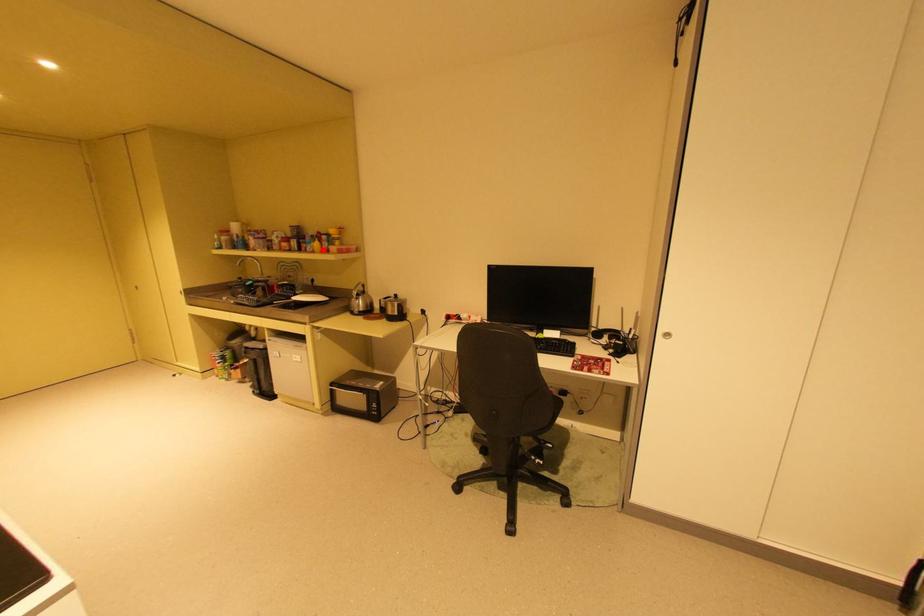
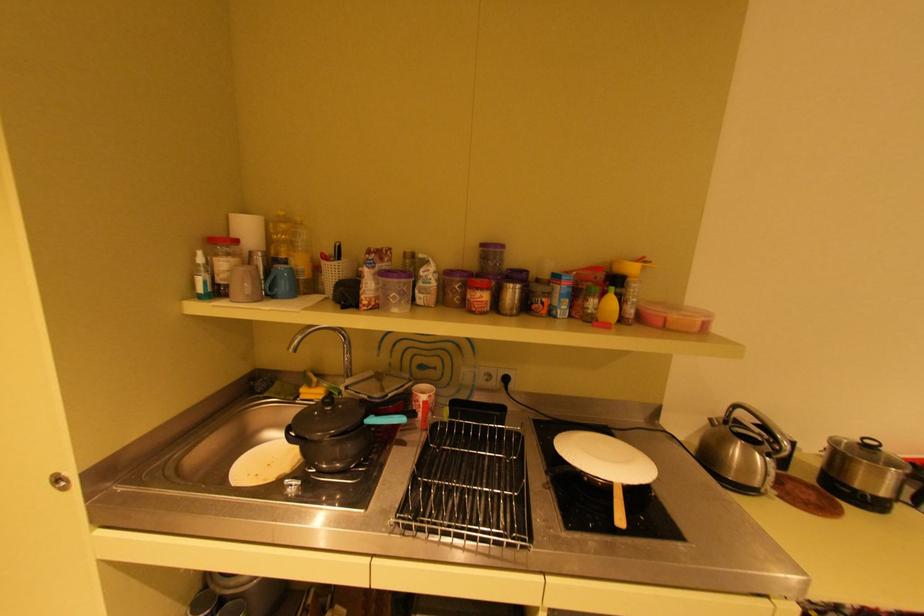
Locate, in the second image, the point that corresponds to the highlighted location in the first image.

(611, 318)